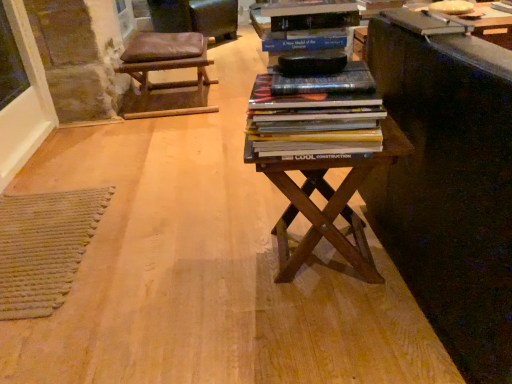
Where is `vacant space that is to the left of brown wooden table at center`? vacant space that is to the left of brown wooden table at center is located at coordinates (204, 264).